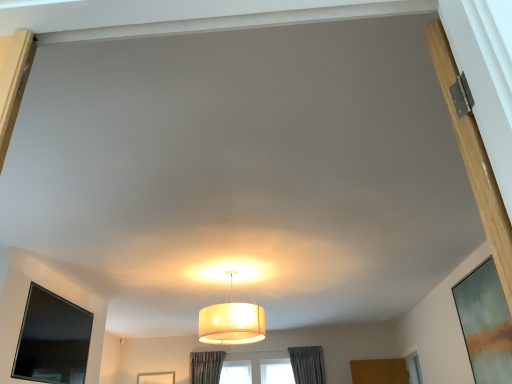
The width and height of the screenshot is (512, 384). Identify the location of matte glass window screen at right, the first window screen viewed from the right. pyautogui.click(x=485, y=324).

You are a GUI agent. You are given a task and a screenshot of the screen. Output one action in this format:
    pyautogui.click(x=<x>, y=<y>)
    Task: Click on the black glossy tv at lower left, the first window screen when ordered from left to right
    This screenshot has height=384, width=512.
    Given the screenshot: What is the action you would take?
    pyautogui.click(x=52, y=339)

Considering the sizes of objects matte glass window screen at right, arranged as the second window screen when viewed from the left, and black glossy tv at lower left, which is the second window screen in right-to-left order, in the image provided, who is wider, matte glass window screen at right, arranged as the second window screen when viewed from the left, or black glossy tv at lower left, which is the second window screen in right-to-left order,?

black glossy tv at lower left, which is the second window screen in right-to-left order, is wider.

Is matte glass window screen at right, arranged as the second window screen when viewed from the left, taller or shorter than black glossy tv at lower left, which is the second window screen in right-to-left order?

Considering their sizes, matte glass window screen at right, arranged as the second window screen when viewed from the left, has more height than black glossy tv at lower left, which is the second window screen in right-to-left order.

Is matte glass window screen at right, the first window screen viewed from the right, not close to black glossy tv at lower left, the first window screen when ordered from left to right?

Yes, matte glass window screen at right, the first window screen viewed from the right, is far from black glossy tv at lower left, the first window screen when ordered from left to right.

Would you say matte white lampshade at center contains black glossy tv at lower left, which is the second window screen in right-to-left order?

That's incorrect, black glossy tv at lower left, which is the second window screen in right-to-left order, is not inside matte white lampshade at center.

Can you confirm if matte white lampshade at center is shorter than black glossy tv at lower left, which is the second window screen in right-to-left order?

Yes, matte white lampshade at center is shorter than black glossy tv at lower left, which is the second window screen in right-to-left order.

Is matte white lampshade at center in front of or behind black glossy tv at lower left, the first window screen when ordered from left to right, in the image?

In the image, matte white lampshade at center appears behind black glossy tv at lower left, the first window screen when ordered from left to right.

In order to click on lamp located above the black glossy tv at lower left, which is the second window screen in right-to-left order (from the image's perspective) in this screenshot , I will do `click(231, 321)`.

From the image's perspective, is matte glass window screen at right, arranged as the second window screen when viewed from the left, located above or below matte white lampshade at center?

matte glass window screen at right, arranged as the second window screen when viewed from the left, is below matte white lampshade at center.

Looking at this image, does matte glass window screen at right, the first window screen viewed from the right, have a smaller size compared to matte white lampshade at center?

Indeed, matte glass window screen at right, the first window screen viewed from the right, has a smaller size compared to matte white lampshade at center.

How distant is matte glass window screen at right, the first window screen viewed from the right, from matte white lampshade at center?

A distance of 6.46 feet exists between matte glass window screen at right, the first window screen viewed from the right, and matte white lampshade at center.

Which object is positioned more to the right, matte white lampshade at center or matte glass window screen at right, the first window screen viewed from the right?

From the viewer's perspective, matte glass window screen at right, the first window screen viewed from the right, appears more on the right side.

From a real-world perspective, is matte white lampshade at center below matte glass window screen at right, the first window screen viewed from the right?

Actually, matte white lampshade at center is physically above matte glass window screen at right, the first window screen viewed from the right, in the real world.

Is matte white lampshade at center facing towards matte glass window screen at right, the first window screen viewed from the right?

No, matte white lampshade at center is not facing towards matte glass window screen at right, the first window screen viewed from the right.

Which is closer to the camera, [87,352] or [505,358]?

The point [505,358] is closer to the camera.

Does black glossy tv at lower left, which is the second window screen in right-to-left order, appear on the right side of matte glass window screen at right, arranged as the second window screen when viewed from the left?

No, black glossy tv at lower left, which is the second window screen in right-to-left order, is not to the right of matte glass window screen at right, arranged as the second window screen when viewed from the left.

Who is bigger, black glossy tv at lower left, the first window screen when ordered from left to right, or matte glass window screen at right, the first window screen viewed from the right?

matte glass window screen at right, the first window screen viewed from the right.

From the image's perspective, who appears lower, black glossy tv at lower left, which is the second window screen in right-to-left order, or matte glass window screen at right, the first window screen viewed from the right?

black glossy tv at lower left, which is the second window screen in right-to-left order, from the image's perspective.

Can you confirm if black glossy tv at lower left, which is the second window screen in right-to-left order, is bigger than matte white lampshade at center?

No.

Are black glossy tv at lower left, the first window screen when ordered from left to right, and matte white lampshade at center making contact?

black glossy tv at lower left, the first window screen when ordered from left to right, and matte white lampshade at center are not in contact.

What's the angular difference between black glossy tv at lower left, which is the second window screen in right-to-left order, and matte white lampshade at center's facing directions?

There is a 90-degree angle between the facing directions of black glossy tv at lower left, which is the second window screen in right-to-left order, and matte white lampshade at center.

Considering the sizes of objects black glossy tv at lower left, which is the second window screen in right-to-left order, and matte white lampshade at center in the image provided, who is taller, black glossy tv at lower left, which is the second window screen in right-to-left order, or matte white lampshade at center?

black glossy tv at lower left, which is the second window screen in right-to-left order, is taller.

This screenshot has width=512, height=384. Find the location of `window screen in front of the black glossy tv at lower left, the first window screen when ordered from left to right`. window screen in front of the black glossy tv at lower left, the first window screen when ordered from left to right is located at coordinates (485, 324).

You are a GUI agent. You are given a task and a screenshot of the screen. Output one action in this format:
    pyautogui.click(x=<x>, y=<y>)
    Task: Click on the lamp on the right of black glossy tv at lower left, the first window screen when ordered from left to right
    This screenshot has width=512, height=384.
    Given the screenshot: What is the action you would take?
    pyautogui.click(x=231, y=321)

Looking at the image, which one is located closer to black glossy tv at lower left, which is the second window screen in right-to-left order, matte white lampshade at center or matte glass window screen at right, the first window screen viewed from the right?

The object closer to black glossy tv at lower left, which is the second window screen in right-to-left order, is matte white lampshade at center.

Estimate the real-world distances between objects in this image. Which object is closer to matte glass window screen at right, the first window screen viewed from the right, black glossy tv at lower left, which is the second window screen in right-to-left order, or matte white lampshade at center?

Among the two, matte white lampshade at center is located nearer to matte glass window screen at right, the first window screen viewed from the right.

Considering their positions, is black glossy tv at lower left, the first window screen when ordered from left to right, positioned closer to matte white lampshade at center than matte glass window screen at right, the first window screen viewed from the right?

black glossy tv at lower left, the first window screen when ordered from left to right, lies closer to matte white lampshade at center than the other object.

When comparing their distances from matte white lampshade at center, does matte glass window screen at right, the first window screen viewed from the right, or black glossy tv at lower left, the first window screen when ordered from left to right, seem further?

Based on the image, matte glass window screen at right, the first window screen viewed from the right, appears to be further to matte white lampshade at center.

Looking at the image, which one is located further to black glossy tv at lower left, the first window screen when ordered from left to right, matte glass window screen at right, arranged as the second window screen when viewed from the left, or matte white lampshade at center?

matte glass window screen at right, arranged as the second window screen when viewed from the left, is positioned further to the anchor black glossy tv at lower left, the first window screen when ordered from left to right.

Estimate the real-world distances between objects in this image. Which object is further from matte glass window screen at right, the first window screen viewed from the right, matte white lampshade at center or black glossy tv at lower left, which is the second window screen in right-to-left order?

Among the two, black glossy tv at lower left, which is the second window screen in right-to-left order, is located further to matte glass window screen at right, the first window screen viewed from the right.

The width and height of the screenshot is (512, 384). I want to click on lamp located between black glossy tv at lower left, the first window screen when ordered from left to right, and matte glass window screen at right, the first window screen viewed from the right, in the left-right direction, so click(231, 321).